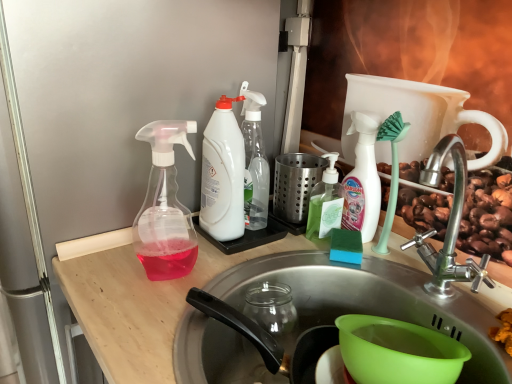
This screenshot has height=384, width=512. In order to click on green translucent soap dispenser at center, which is the 2th bottle in right-to-left order in this screenshot , I will do click(325, 202).

Locate an element on the screen. This screenshot has height=384, width=512. transparent plastic spray bottle at left, the first bottle when ordered from left to right is located at coordinates (165, 207).

Describe the element at coordinates (223, 174) in the screenshot. Image resolution: width=512 pixels, height=384 pixels. I see `white plastic bottle at center, arranged as the 4th bottle when viewed from the right` at that location.

What are the coordinates of `green translucent soap dispenser at center, which is the fourth bottle in left-to-right order` in the screenshot? It's located at (325, 202).

In terms of width, does green translucent soap dispenser at center, which is the 2th bottle in right-to-left order, look wider or thinner when compared to white plastic spray bottle at center, which is the 3th bottle from left to right?

Clearly, green translucent soap dispenser at center, which is the 2th bottle in right-to-left order, has more width compared to white plastic spray bottle at center, which is the 3th bottle from left to right.

How distant is green translucent soap dispenser at center, which is the 2th bottle in right-to-left order, from white plastic spray bottle at center, which is the 3th bottle from left to right?

green translucent soap dispenser at center, which is the 2th bottle in right-to-left order, is 5.69 inches away from white plastic spray bottle at center, which is the 3th bottle from left to right.

Does green translucent soap dispenser at center, which is the fourth bottle in left-to-right order, turn towards white plastic spray bottle at center, which is counted as the 3th bottle, starting from the right?

No, green translucent soap dispenser at center, which is the fourth bottle in left-to-right order, is not turned towards white plastic spray bottle at center, which is counted as the 3th bottle, starting from the right.

Does green translucent soap dispenser at center, which is the fourth bottle in left-to-right order, touch white plastic spray bottle at center, which is the 3th bottle from left to right?

No, green translucent soap dispenser at center, which is the fourth bottle in left-to-right order, is not in contact with white plastic spray bottle at center, which is the 3th bottle from left to right.

Does transparent plastic spray bottle at left, acting as the 5th bottle starting from the right, have a greater width compared to white plastic bottle at center, arranged as the 2th bottle when viewed from the left?

Yes.

Considering the relative sizes of transparent plastic spray bottle at left, acting as the 5th bottle starting from the right, and white plastic bottle at center, arranged as the 2th bottle when viewed from the left, in the image provided, is transparent plastic spray bottle at left, acting as the 5th bottle starting from the right, bigger than white plastic bottle at center, arranged as the 2th bottle when viewed from the left,?

No.

Does transparent plastic spray bottle at left, acting as the 5th bottle starting from the right, have a greater height compared to white plastic bottle at center, arranged as the 2th bottle when viewed from the left?

Incorrect, the height of transparent plastic spray bottle at left, acting as the 5th bottle starting from the right, is not larger of that of white plastic bottle at center, arranged as the 2th bottle when viewed from the left.

From the image's perspective, starting from the white plastic bottle at center, arranged as the 4th bottle when viewed from the right, which bottle is the 3rd one below? Please provide its 2D coordinates.

[(165, 207)]

Is white plastic bottle at center, arranged as the 2th bottle when viewed from the left, aimed at white plastic spray bottle at center, which is the 3th bottle from left to right?

Yes, white plastic bottle at center, arranged as the 2th bottle when viewed from the left, is facing white plastic spray bottle at center, which is the 3th bottle from left to right.

Considering the sizes of objects white plastic bottle at center, arranged as the 2th bottle when viewed from the left, and white plastic spray bottle at center, which is the 3th bottle from left to right, in the image provided, who is taller, white plastic bottle at center, arranged as the 2th bottle when viewed from the left, or white plastic spray bottle at center, which is the 3th bottle from left to right,?

white plastic spray bottle at center, which is the 3th bottle from left to right, is taller.

Based on the photo, in the image, is white plastic bottle at center, arranged as the 4th bottle when viewed from the right, positioned in front of or behind white plastic spray bottle at center, which is counted as the 3th bottle, starting from the right?

Clearly, white plastic bottle at center, arranged as the 4th bottle when viewed from the right, is in front of white plastic spray bottle at center, which is counted as the 3th bottle, starting from the right.

Considering the sizes of objects white plastic bottle at center, arranged as the 2th bottle when viewed from the left, and transparent plastic spray bottle at left, the first bottle when ordered from left to right, in the image provided, who is taller, white plastic bottle at center, arranged as the 2th bottle when viewed from the left, or transparent plastic spray bottle at left, the first bottle when ordered from left to right,?

white plastic bottle at center, arranged as the 2th bottle when viewed from the left.

Is white plastic bottle at center, arranged as the 4th bottle when viewed from the right, far from transparent plastic spray bottle at left, the first bottle when ordered from left to right?

No, there isn't a large distance between white plastic bottle at center, arranged as the 4th bottle when viewed from the right, and transparent plastic spray bottle at left, the first bottle when ordered from left to right.

From a real-world perspective, which is physically above, white plastic bottle at center, arranged as the 2th bottle when viewed from the left, or transparent plastic spray bottle at left, acting as the 5th bottle starting from the right?

From a 3D spatial view, white plastic bottle at center, arranged as the 2th bottle when viewed from the left, is above.

From the image's perspective, which one is positioned higher, white plastic bottle at center, arranged as the 4th bottle when viewed from the right, or transparent plastic spray bottle at left, acting as the 5th bottle starting from the right?

white plastic bottle at center, arranged as the 4th bottle when viewed from the right, appears higher in the image.

Is white plastic spray bottle at center, which is counted as the 3th bottle, starting from the right, surrounding green translucent soap dispenser at center, which is the 2th bottle in right-to-left order?

No, white plastic spray bottle at center, which is counted as the 3th bottle, starting from the right, does not contain green translucent soap dispenser at center, which is the 2th bottle in right-to-left order.

Is point (266, 182) farther from camera compared to point (334, 216)?

Yes, point (266, 182) is farther from viewer.

Is white plastic spray bottle at center, which is counted as the 3th bottle, starting from the right, wider than green translucent soap dispenser at center, which is the fourth bottle in left-to-right order?

Incorrect, the width of white plastic spray bottle at center, which is counted as the 3th bottle, starting from the right, does not surpass that of green translucent soap dispenser at center, which is the fourth bottle in left-to-right order.

Between white plastic spray bottle at center, which is the 3th bottle from left to right, and green translucent soap dispenser at center, which is the 2th bottle in right-to-left order, which one appears on the left side from the viewer's perspective?

Positioned to the left is white plastic spray bottle at center, which is the 3th bottle from left to right.

From the image's perspective, count 1st bottles upward from the green translucent soap dispenser at center, which is the 2th bottle in right-to-left order, and point to it. Please provide its 2D coordinates.

[(362, 179)]

Is white matte bottle at center, marked as the 1th bottle in a right-to-left arrangement, surrounding green translucent soap dispenser at center, which is the fourth bottle in left-to-right order?

No, white matte bottle at center, marked as the 1th bottle in a right-to-left arrangement, does not contain green translucent soap dispenser at center, which is the fourth bottle in left-to-right order.

Considering the positions of point (356, 159) and point (318, 228), is point (356, 159) closer or farther from the camera than point (318, 228)?

Clearly, point (356, 159) is closer to the camera than point (318, 228).

Can you confirm if white matte bottle at center, positioned as the fifth bottle in left-to-right order, is wider than green translucent soap dispenser at center, which is the 2th bottle in right-to-left order?

Incorrect, the width of white matte bottle at center, positioned as the fifth bottle in left-to-right order, does not surpass that of green translucent soap dispenser at center, which is the 2th bottle in right-to-left order.

From the picture: From the image's perspective, is stainless steel sink at center over green translucent soap dispenser at center, which is the 2th bottle in right-to-left order?

No, from the image's perspective, stainless steel sink at center is not on top of green translucent soap dispenser at center, which is the 2th bottle in right-to-left order.

Between stainless steel sink at center and green translucent soap dispenser at center, which is the 2th bottle in right-to-left order, which one appears on the right side from the viewer's perspective?

From the viewer's perspective, green translucent soap dispenser at center, which is the 2th bottle in right-to-left order, appears more on the right side.

Which point is more forward, (x=189, y=325) or (x=327, y=187)?

The point (x=189, y=325) is closer to the camera.

From the picture: Considering the sizes of stainless steel sink at center and green translucent soap dispenser at center, which is the 2th bottle in right-to-left order, in the image, is stainless steel sink at center wider or thinner than green translucent soap dispenser at center, which is the 2th bottle in right-to-left order,?

Clearly, stainless steel sink at center has more width compared to green translucent soap dispenser at center, which is the 2th bottle in right-to-left order.

At what (x,y) coordinates should I click in order to perform the action: click on bottle that is the 4th object directly below the white plastic spray bottle at center, which is the 3th bottle from left to right (from a real-world perspective). Please return your answer as a coordinate pair (x, y). The image size is (512, 384). Looking at the image, I should click on (325, 202).

Find the location of `bottle that is the 1st one when counting rightward from the transparent plastic spray bottle at left, the first bottle when ordered from left to right`. bottle that is the 1st one when counting rightward from the transparent plastic spray bottle at left, the first bottle when ordered from left to right is located at coordinates (223, 174).

Looking at the image, which one is located closer to white plastic spray bottle at center, which is counted as the 3th bottle, starting from the right, white plastic bottle at center, arranged as the 4th bottle when viewed from the right, or stainless steel sink at center?

Answer: white plastic bottle at center, arranged as the 4th bottle when viewed from the right, is closer to white plastic spray bottle at center, which is counted as the 3th bottle, starting from the right.

Based on the photo, from the image, which object appears to be farther from white plastic bottle at center, arranged as the 4th bottle when viewed from the right, white matte bottle at center, marked as the 1th bottle in a right-to-left arrangement, or stainless steel sink at center?

white matte bottle at center, marked as the 1th bottle in a right-to-left arrangement, is further to white plastic bottle at center, arranged as the 4th bottle when viewed from the right.

Which object lies further to the anchor point stainless steel sink at center, transparent plastic spray bottle at left, acting as the 5th bottle starting from the right, or white plastic bottle at center, arranged as the 4th bottle when viewed from the right?

white plastic bottle at center, arranged as the 4th bottle when viewed from the right.

Looking at the image, which one is located further to green translucent soap dispenser at center, which is the 2th bottle in right-to-left order, white matte bottle at center, positioned as the fifth bottle in left-to-right order, or white plastic bottle at center, arranged as the 4th bottle when viewed from the right?

white plastic bottle at center, arranged as the 4th bottle when viewed from the right, is positioned further to the anchor green translucent soap dispenser at center, which is the 2th bottle in right-to-left order.

Which object lies nearer to the anchor point white plastic bottle at center, arranged as the 4th bottle when viewed from the right, stainless steel sink at center or green translucent soap dispenser at center, which is the 2th bottle in right-to-left order?

green translucent soap dispenser at center, which is the 2th bottle in right-to-left order, is closer to white plastic bottle at center, arranged as the 4th bottle when viewed from the right.

Looking at the image, which one is located further to white plastic spray bottle at center, which is the 3th bottle from left to right, white matte bottle at center, positioned as the fifth bottle in left-to-right order, or stainless steel sink at center?

stainless steel sink at center is positioned further to the anchor white plastic spray bottle at center, which is the 3th bottle from left to right.

Considering their positions, is green translucent soap dispenser at center, which is the fourth bottle in left-to-right order, positioned closer to white matte bottle at center, marked as the 1th bottle in a right-to-left arrangement, than stainless steel sink at center?

Based on the image, green translucent soap dispenser at center, which is the fourth bottle in left-to-right order, appears to be nearer to white matte bottle at center, marked as the 1th bottle in a right-to-left arrangement.

Which object lies further to the anchor point transparent plastic spray bottle at left, acting as the 5th bottle starting from the right, stainless steel sink at center or white matte bottle at center, positioned as the fifth bottle in left-to-right order?

white matte bottle at center, positioned as the fifth bottle in left-to-right order, lies further to transparent plastic spray bottle at left, acting as the 5th bottle starting from the right, than the other object.

Identify the location of bottle situated between white plastic spray bottle at center, which is the 3th bottle from left to right, and white matte bottle at center, positioned as the fifth bottle in left-to-right order, from left to right. tap(325, 202).

This screenshot has height=384, width=512. I want to click on bottle located between white plastic bottle at center, arranged as the 2th bottle when viewed from the left, and green translucent soap dispenser at center, which is the 2th bottle in right-to-left order, in the left-right direction, so click(x=254, y=161).